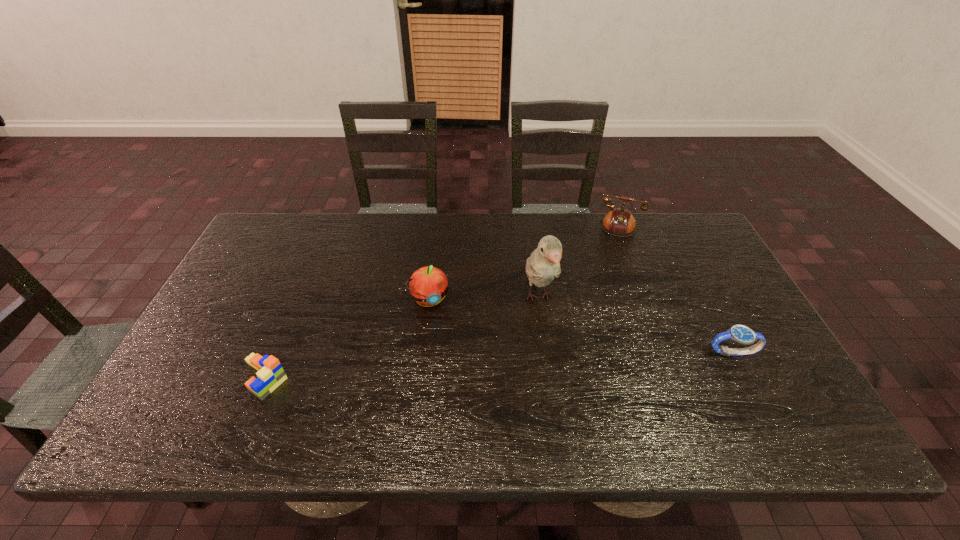
The height and width of the screenshot is (540, 960). Find the location of `the leftmost object`. the leftmost object is located at coordinates (270, 374).

Where is `the rightmost object`? the rightmost object is located at coordinates (739, 333).

Image resolution: width=960 pixels, height=540 pixels. Identify the location of bird. (543, 265).

I want to click on the tallest object, so click(543, 265).

Where is `the second object from left to right`? The image size is (960, 540). the second object from left to right is located at coordinates (428, 285).

The image size is (960, 540). I want to click on the farthest object, so click(619, 222).

I want to click on the fourth object from left to right, so click(x=619, y=222).

Identify the location of vacant space located on the back of the Lego. The width and height of the screenshot is (960, 540). (296, 301).

You are a GUI agent. You are given a task and a screenshot of the screen. Output one action in this format:
    pyautogui.click(x=<x>, y=<y>)
    Task: Click on the free space located on the front of the rightmost object
    The image size is (960, 540).
    Given the screenshot: What is the action you would take?
    pyautogui.click(x=757, y=402)

What are the coordinates of `vacant area situated 0.140m at the face of the third object from left to right` in the screenshot? It's located at (560, 368).